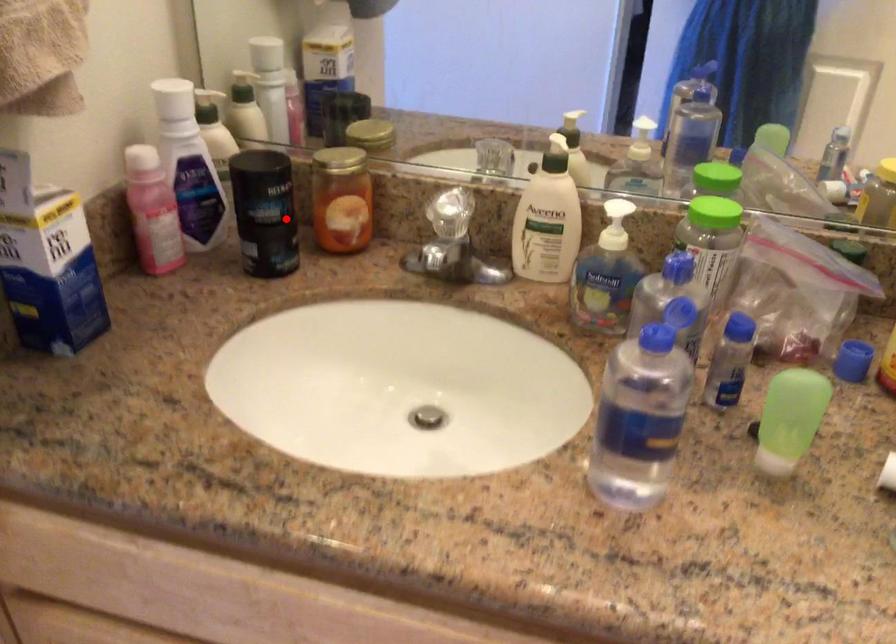
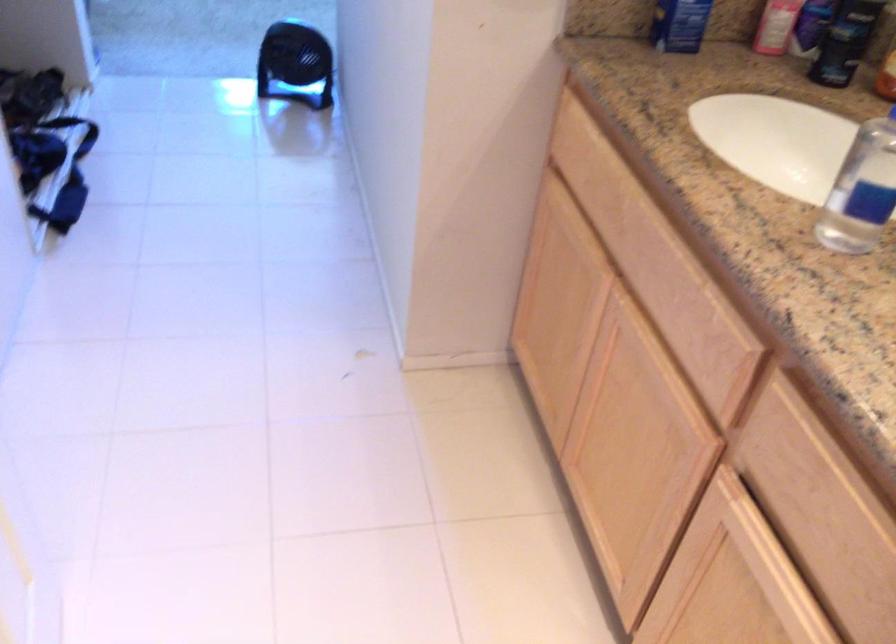
Question: I am providing you with two images of the same scene from different viewpoints. Given a red point in image1, look at the same physical point in image2. Is it:

Choices:
 (A) Closer to the viewpoint
 (B) Farther from the viewpoint

Answer: (B)